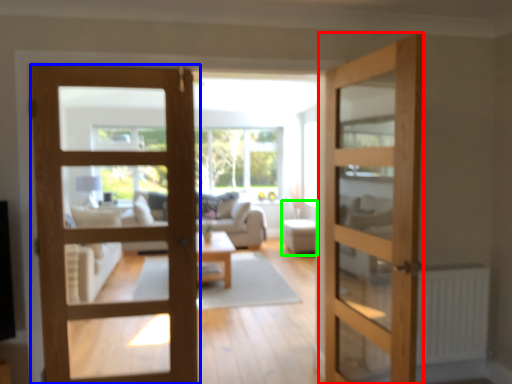
Question: Which object is the farthest from door (highlighted by a red box)? Choose among these: door (highlighted by a blue box) or furniture (highlighted by a green box).

Choices:
 (A) door
 (B) furniture

Answer: (B)